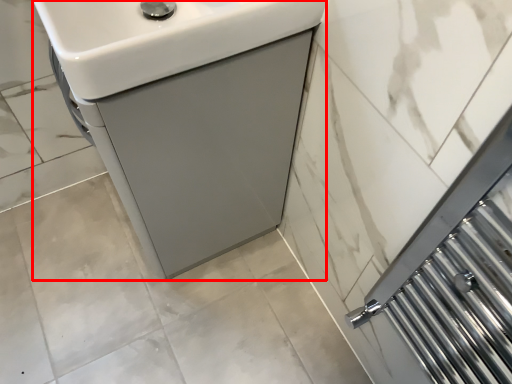
Question: From the image's perspective, considering the relative positions of sink (annotated by the red box) and sink in the image provided, where is sink (annotated by the red box) located with respect to the staircase?

Choices:
 (A) below
 (B) above

Answer: (A)